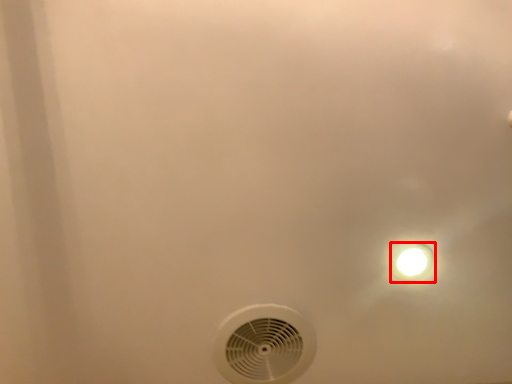
Question: Considering the relative positions of light fixture (annotated by the red box) and mechanical fan in the image provided, where is light fixture (annotated by the red box) located with respect to the staircase?

Choices:
 (A) right
 (B) left

Answer: (A)